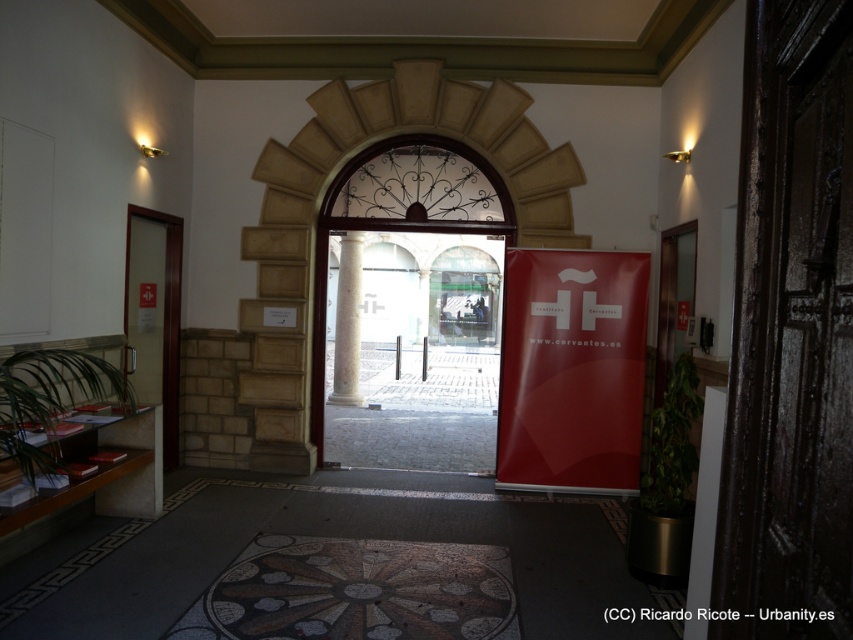
You are standing in the hallway and want to move from the white marble column at center to the white glossy pillar at right. Which direction should you move to reach the pillar?

To move from the white marble column at center to the white glossy pillar at right, you should move to your right since the white glossy pillar at right is positioned on the right side of the white marble column at center.

You are standing in the hallway and want to exit to the courtyard. Which object should you approach to exit? Please choose between the transparent glass door at center and the red banner with white logo on the right.

The transparent glass door at center is the correct exit to the courtyard as it is a door leading outside, while the red banner with white logo on the right is just a decorative element.

You are a delivery person trying to enter the courtyard through the transparent glass door at left. The white glossy pillar at right is blocking your path. Can you pass through the space between them?

The transparent glass door at left is larger in size than white glossy pillar at right, so the space between them may be sufficient for passage. However, without knowing the exact distance between them, it is difficult to confirm if there is enough space to pass through safely.